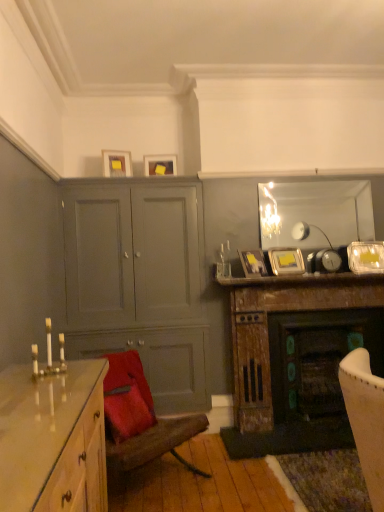
Question: Would you say velvet red chair at lower left is to the left or to the right of matte gray cabinet at center-left in the picture?

Choices:
 (A) left
 (B) right

Answer: (B)

Question: From the image's perspective, is velvet red chair at lower left above or below matte gray cabinet at center-left?

Choices:
 (A) below
 (B) above

Answer: (A)

Question: Which is farther from the matte yellow picture frame at upper center, the second picture frame positioned from the left?

Choices:
 (A) velvet red chair at lower left
 (B) clear glass mirror at upper center
 (C) matte yellow picture frame at upper center, which is the first picture frame in top-to-bottom order
 (D) gold metallic candle holder at left
 (E) wooden fireplace at center

Answer: (D)

Question: Which of these objects is positioned closest to the wooden fireplace at center?

Choices:
 (A) glossy wood chest of drawers at lower left
 (B) matte black picture frame at upper center, arranged as the third picture frame when viewed from the left
 (C) metallic silver picture frame at upper right, which ranks as the fifth picture frame in left-to-right order
 (D) velvet red chair at lower left
 (E) clear glass mirror at upper center

Answer: (C)